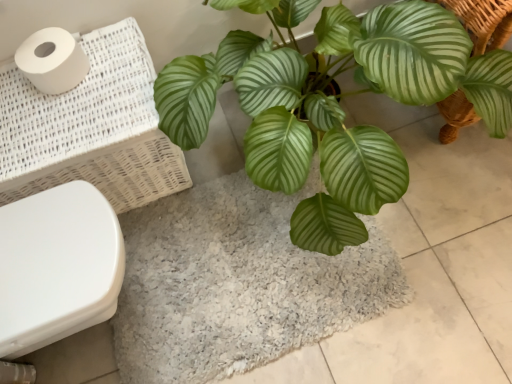
Where is `vacant area located to the right-hand side of white matte toilet paper at upper left`? The height and width of the screenshot is (384, 512). vacant area located to the right-hand side of white matte toilet paper at upper left is located at coordinates (120, 66).